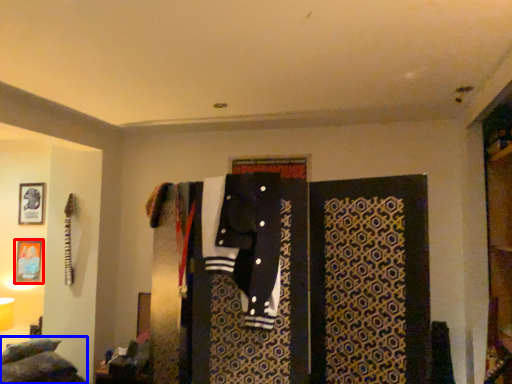
Question: Which of the following is the closest to the observer, picture frame (highlighted by a red box) or bed (highlighted by a blue box)?

Choices:
 (A) picture frame
 (B) bed

Answer: (B)